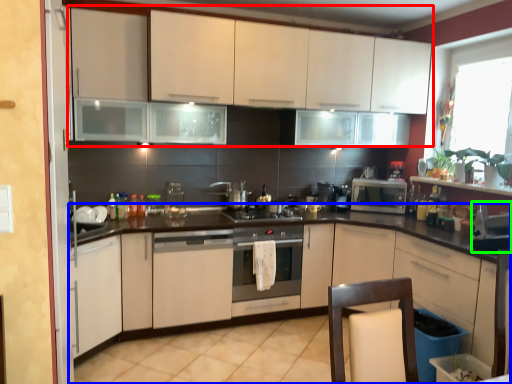
Question: Considering the real-world distances, which object is farthest from cabinetry (highlighted by a red box)? cabinetry (highlighted by a blue box) or appliance (highlighted by a green box)?

Choices:
 (A) cabinetry
 (B) appliance

Answer: (B)